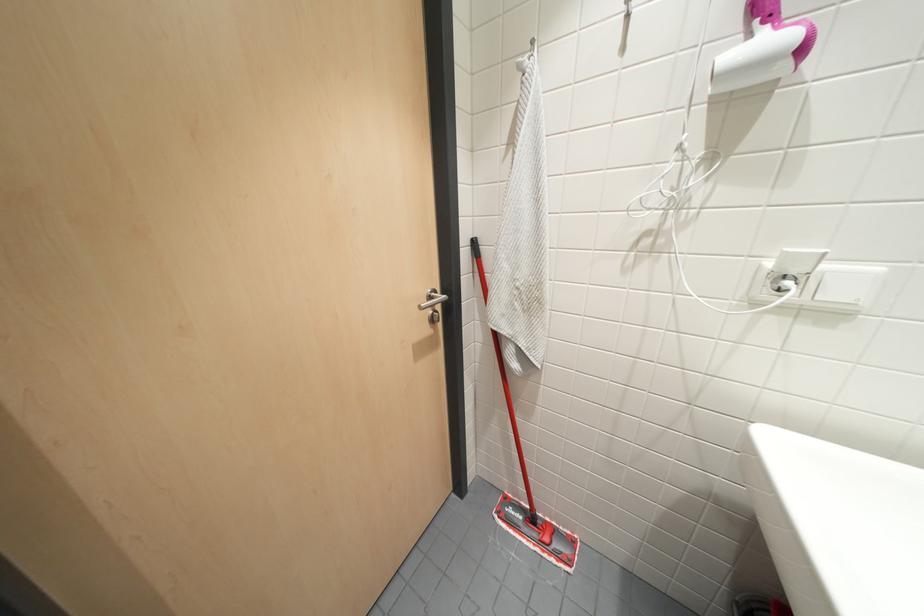
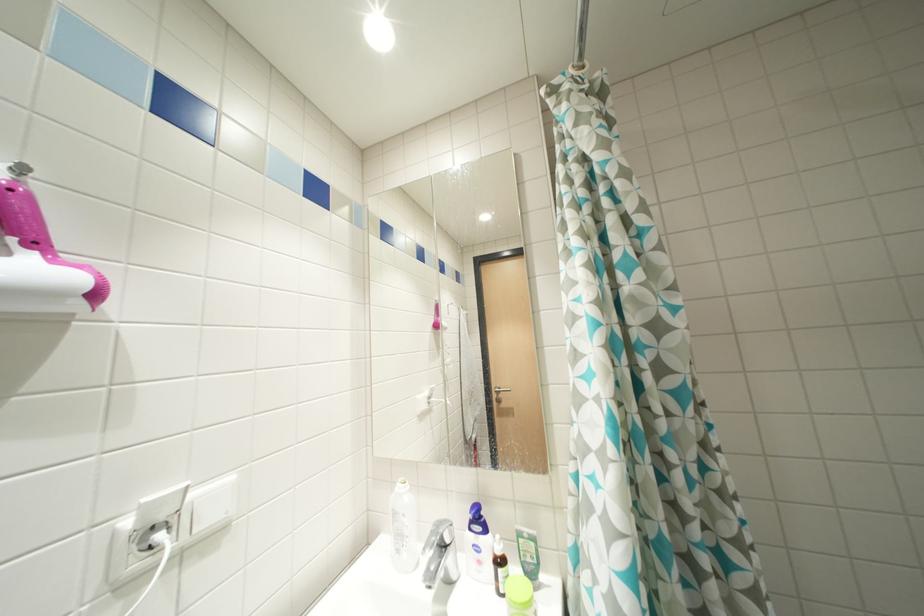
Question: How did the camera likely rotate?

Choices:
 (A) Left
 (B) Right
 (C) Up
 (D) Down

Answer: (B)